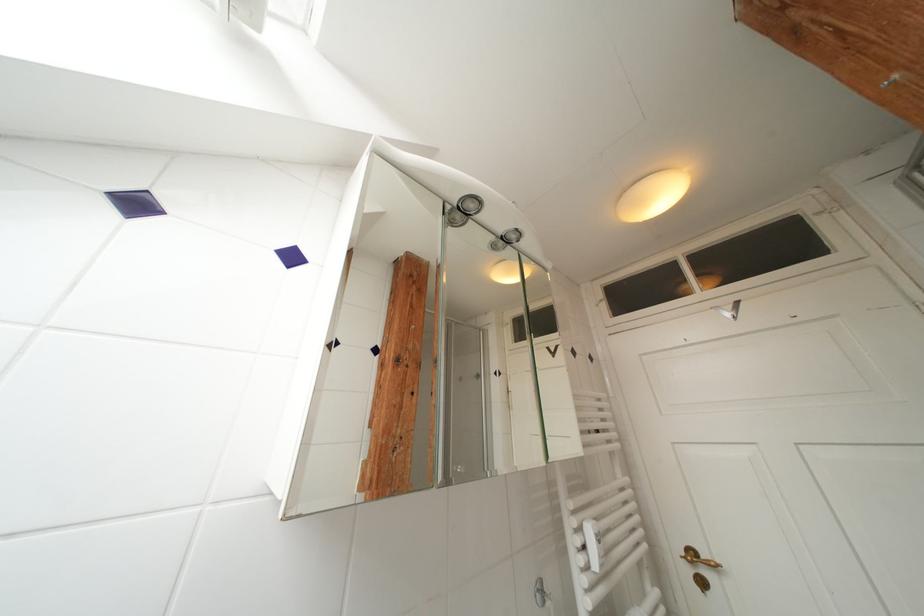
The width and height of the screenshot is (924, 616). What do you see at coordinates (590, 535) in the screenshot?
I see `a radiator control knob` at bounding box center [590, 535].